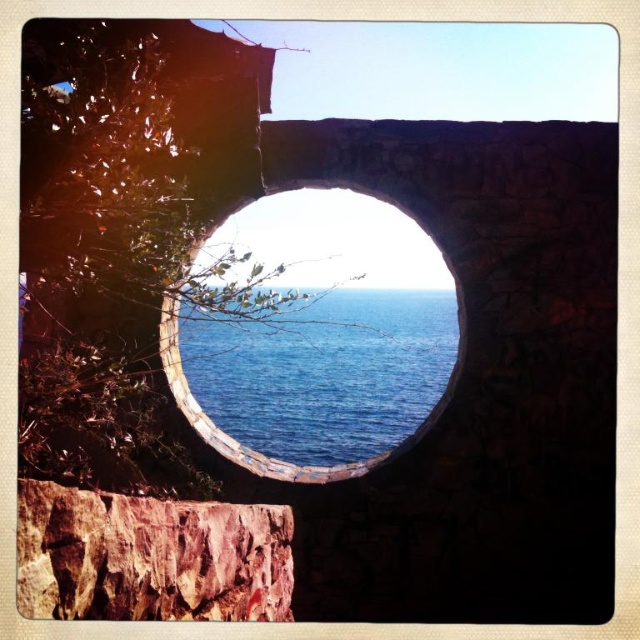
Question: Does rustic stone cliff at center come behind smooth stone hole at center?

Choices:
 (A) no
 (B) yes

Answer: (A)

Question: Does rustic stone cliff at center appear on the right side of smooth stone hole at center?

Choices:
 (A) yes
 (B) no

Answer: (A)

Question: Which point is farther to the camera?

Choices:
 (A) smooth stone hole at center
 (B) rustic stone cliff at center

Answer: (A)

Question: Does rustic stone cliff at center have a larger size compared to smooth stone hole at center?

Choices:
 (A) yes
 (B) no

Answer: (B)